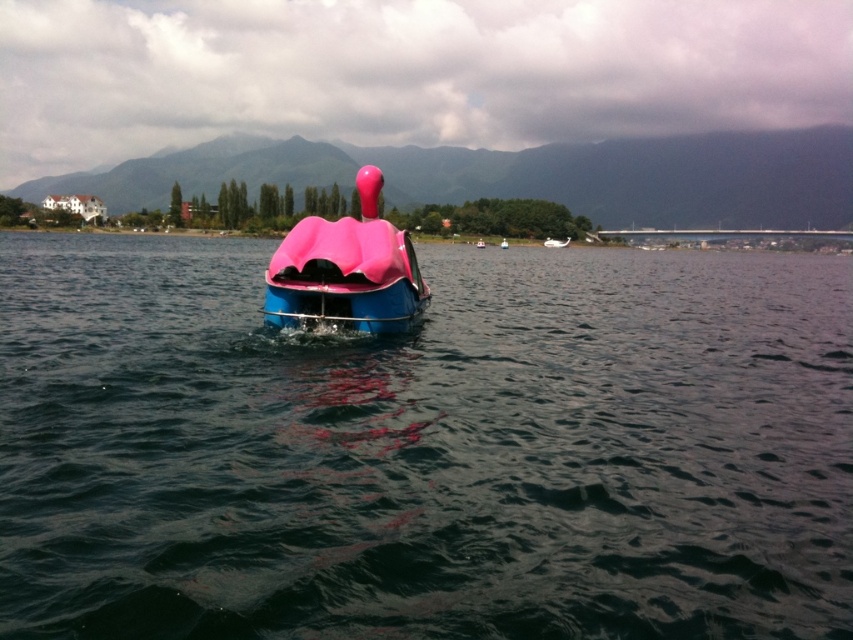
Question: Which of the following is the closest to the observer?

Choices:
 (A) (552, 248)
 (B) (323, 237)

Answer: (B)

Question: Is transparent blue water at center above pink matte swan boat at center?

Choices:
 (A) yes
 (B) no

Answer: (A)

Question: Can you confirm if pink matte swan boat at center is positioned below pink matte swan at center?

Choices:
 (A) yes
 (B) no

Answer: (A)

Question: Which of the following is the closest to the observer?

Choices:
 (A) transparent blue water at center
 (B) pink matte swan boat at center
 (C) pink matte swan at center

Answer: (A)

Question: Which object appears farthest from the camera in this image?

Choices:
 (A) pink matte swan at center
 (B) pink matte swan boat at center
 (C) transparent blue water at center

Answer: (A)

Question: Does pink matte swan boat at center have a smaller size compared to pink matte swan at center?

Choices:
 (A) no
 (B) yes

Answer: (B)